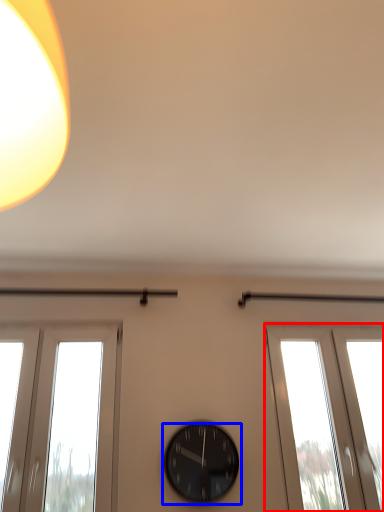
Question: Which object appears closest to the camera in this image, window (highlighted by a red box) or wall clock (highlighted by a blue box)?

Choices:
 (A) window
 (B) wall clock

Answer: (B)